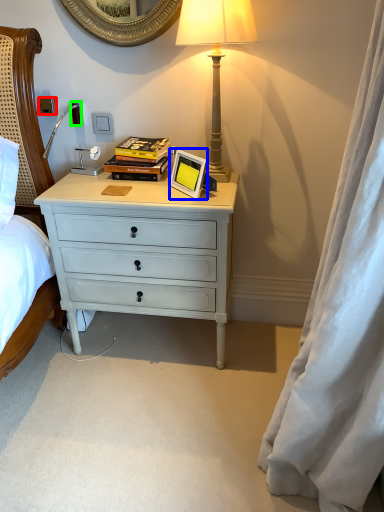
Question: Which is farther away from power outlet (highlighted by a red box)? picture frame (highlighted by a blue box) or power outlet (highlighted by a green box)?

Choices:
 (A) picture frame
 (B) power outlet

Answer: (A)